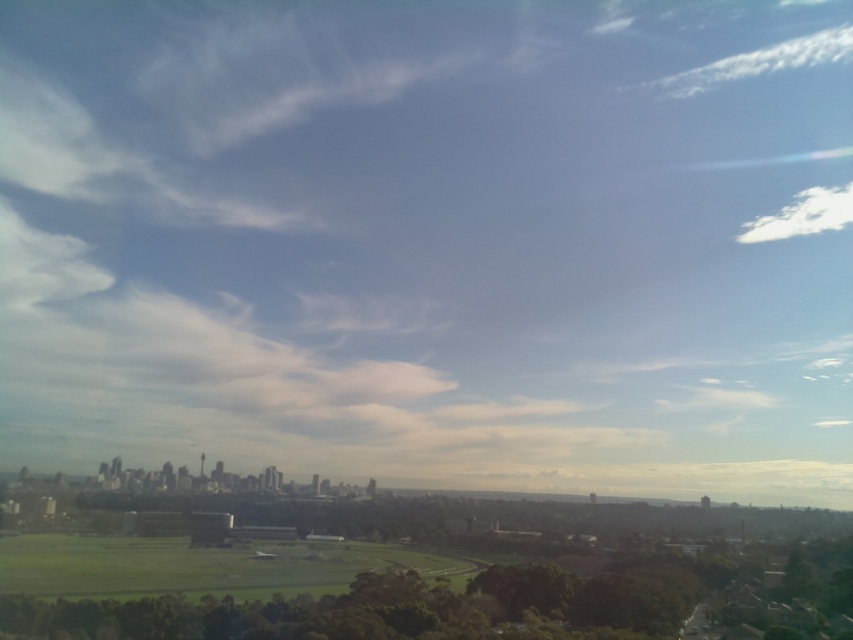
Question: Can you confirm if green leafy tree at lower center is smaller than white fluffy cloud at upper right?

Choices:
 (A) yes
 (B) no

Answer: (B)

Question: Does green leafy tree at lower center come behind white fluffy cloud at upper right?

Choices:
 (A) yes
 (B) no

Answer: (B)

Question: Does green leafy tree at lower center have a smaller size compared to white fluffy cloud at upper right?

Choices:
 (A) no
 (B) yes

Answer: (A)

Question: Among these objects, which one is nearest to the camera?

Choices:
 (A) white fluffy cloud at upper right
 (B) green leafy tree at lower center

Answer: (B)

Question: Which point appears closest to the camera in this image?

Choices:
 (A) (636, 560)
 (B) (802, 228)

Answer: (A)